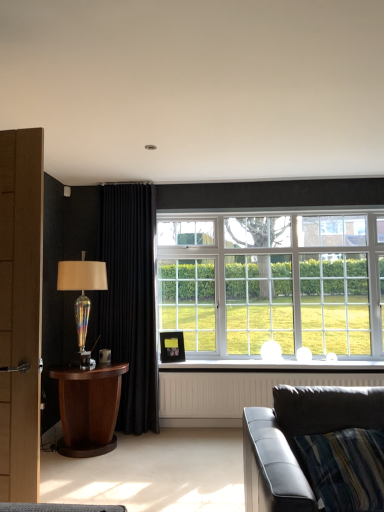
Question: Is leather couch at lower right facing towards wooden table at left?

Choices:
 (A) no
 (B) yes

Answer: (A)

Question: Is leather couch at lower right bigger than wooden table at left?

Choices:
 (A) yes
 (B) no

Answer: (A)

Question: Does leather couch at lower right touch wooden table at left?

Choices:
 (A) no
 (B) yes

Answer: (A)

Question: Is leather couch at lower right taller than wooden table at left?

Choices:
 (A) yes
 (B) no

Answer: (A)

Question: From a real-world perspective, is leather couch at lower right positioned over wooden table at left based on gravity?

Choices:
 (A) no
 (B) yes

Answer: (B)

Question: In the image, is leather couch at lower right on the left side or the right side of white textured radiator at lower center?

Choices:
 (A) left
 (B) right

Answer: (A)

Question: From the image's perspective, is leather couch at lower right located above or below white textured radiator at lower center?

Choices:
 (A) above
 (B) below

Answer: (A)

Question: Is leather couch at lower right taller or shorter than white textured radiator at lower center?

Choices:
 (A) tall
 (B) short

Answer: (A)

Question: Is point (253, 412) positioned closer to the camera than point (230, 396)?

Choices:
 (A) closer
 (B) farther

Answer: (A)

Question: In terms of height, does wooden table at left look taller or shorter compared to white textured radiator at lower center?

Choices:
 (A) short
 (B) tall

Answer: (B)

Question: In the image, is wooden table at left positioned in front of or behind white textured radiator at lower center?

Choices:
 (A) front
 (B) behind

Answer: (A)

Question: Which is correct: wooden table at left is inside white textured radiator at lower center, or outside of it?

Choices:
 (A) outside
 (B) inside

Answer: (A)

Question: Looking at their shapes, would you say wooden table at left is wider or thinner than white textured radiator at lower center?

Choices:
 (A) wide
 (B) thin

Answer: (A)

Question: Would you say white glass window at center is inside or outside black velvet curtain at left?

Choices:
 (A) inside
 (B) outside

Answer: (B)

Question: From a real-world perspective, is white glass window at center physically located above or below black velvet curtain at left?

Choices:
 (A) above
 (B) below

Answer: (A)